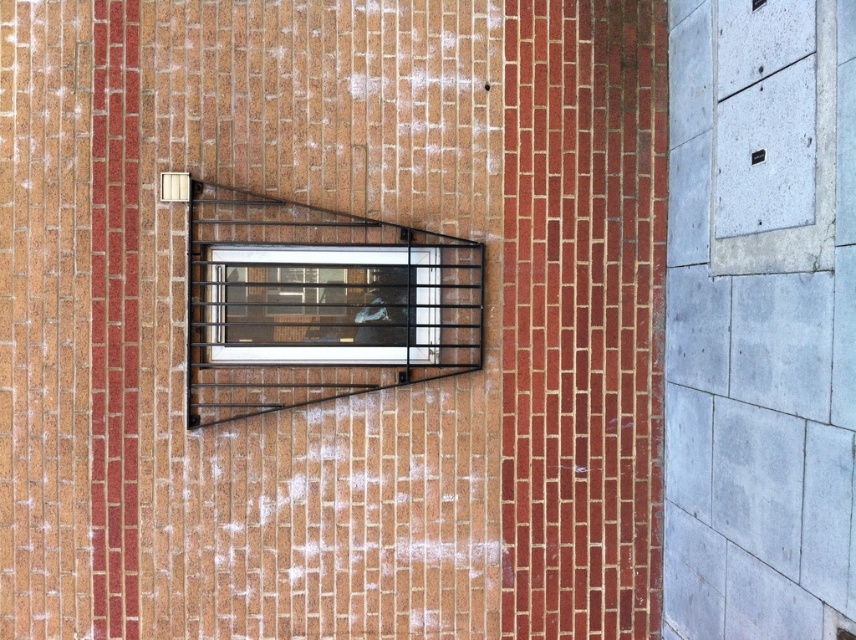
Question: Which object appears closest to the camera in this image?

Choices:
 (A) black metal fire escape at center
 (B) clear glass window at center

Answer: (A)

Question: Is black metal fire escape at center positioned behind clear glass window at center?

Choices:
 (A) yes
 (B) no

Answer: (B)

Question: Which of the following is the farthest from the observer?

Choices:
 (A) (321, 216)
 (B) (333, 284)

Answer: (B)

Question: Is the position of black metal fire escape at center more distant than that of clear glass window at center?

Choices:
 (A) no
 (B) yes

Answer: (A)

Question: Can you confirm if black metal fire escape at center is thinner than clear glass window at center?

Choices:
 (A) yes
 (B) no

Answer: (B)